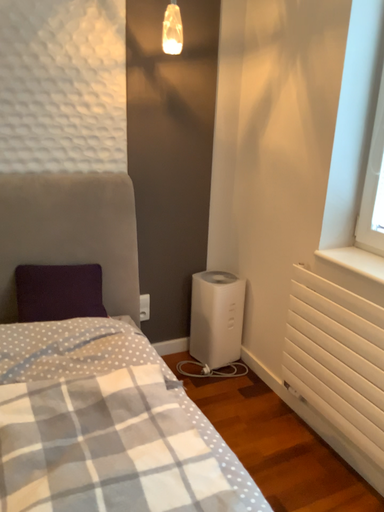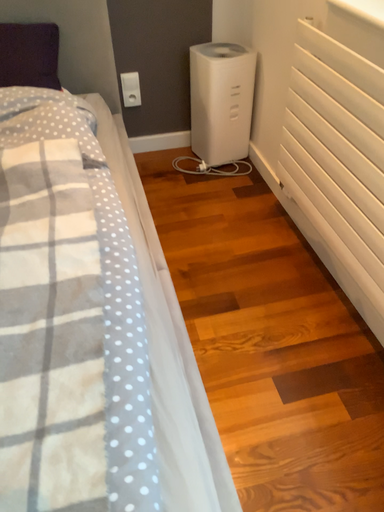
Question: How did the camera likely rotate when shooting the video?

Choices:
 (A) rotated upward
 (B) rotated downward

Answer: (B)